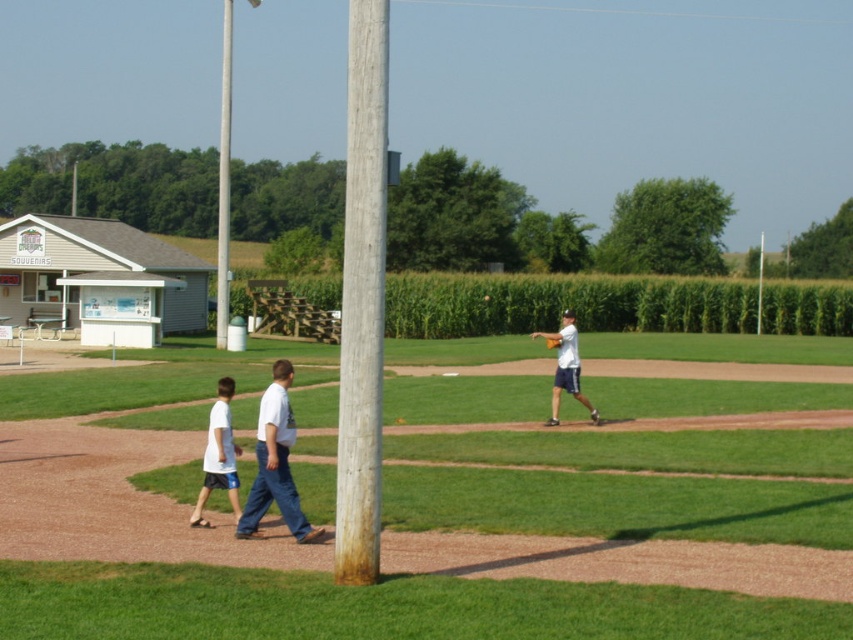
Who is taller, white wooden building at left or smooth gray pole at center?

Standing taller between the two is smooth gray pole at center.

Who is positioned more to the right, white wooden building at left or smooth gray pole at center?

From the viewer's perspective, white wooden building at left appears more on the right side.

Locate an element on the screen. This screenshot has height=640, width=853. white wooden building at left is located at coordinates (99, 278).

Between smooth gray pole at center and white cotton shirt at lower left, which one has less height?

Standing shorter between the two is white cotton shirt at lower left.

Can you confirm if smooth gray pole at center is bigger than white cotton shirt at lower left?

Yes.

Which is in front, point (227, 284) or point (206, 493)?

Point (206, 493)

The height and width of the screenshot is (640, 853). In order to click on smooth gray pole at center in this screenshot , I will do `click(224, 179)`.

Between white wooden building at left and white matte baseball glove at center, which one has more height?

white wooden building at left

Who is more forward, (x=114, y=262) or (x=587, y=400)?

Point (x=587, y=400)

Image resolution: width=853 pixels, height=640 pixels. What do you see at coordinates (99, 278) in the screenshot?
I see `white wooden building at left` at bounding box center [99, 278].

The height and width of the screenshot is (640, 853). I want to click on white wooden building at left, so [x=99, y=278].